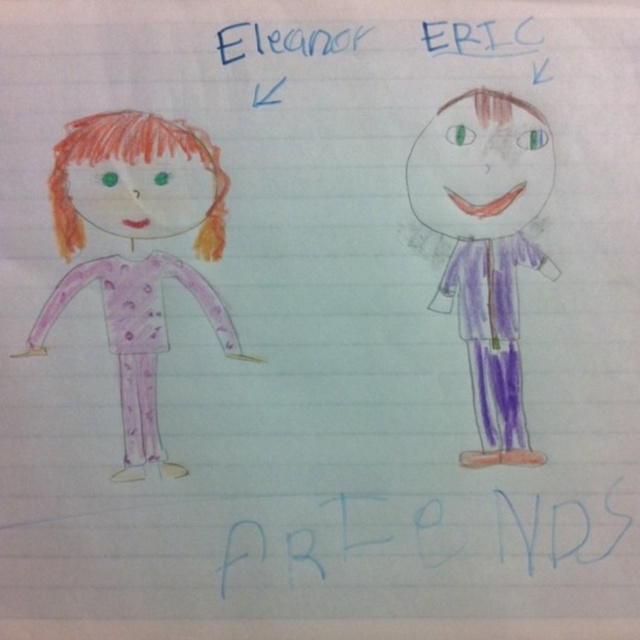
Does matte pink pajamas at left appear on the right side of blue paper at center?

Incorrect, matte pink pajamas at left is not on the right side of blue paper at center.

Who is more distant from viewer, (x=132, y=352) or (x=360, y=534)?

Positioned behind is point (x=132, y=352).

Who is more distant from viewer, (131, 461) or (220, 580)?

Positioned behind is point (131, 461).

Where is `matte pink pajamas at left`? Image resolution: width=640 pixels, height=640 pixels. matte pink pajamas at left is located at coordinates (138, 180).

Is blue paper at center smaller than purple paper doll at right?

Indeed, blue paper at center has a smaller size compared to purple paper doll at right.

Is blue paper at center further to camera compared to purple paper doll at right?

Yes, blue paper at center is further from the viewer.

Locate an element on the screen. Image resolution: width=640 pixels, height=640 pixels. blue paper at center is located at coordinates (428, 538).

Does matte pink pajamas at left have a lesser width compared to purple paper doll at right?

In fact, matte pink pajamas at left might be wider than purple paper doll at right.

Who is positioned more to the right, matte pink pajamas at left or purple paper doll at right?

purple paper doll at right

Where is `matte pink pajamas at left`? The image size is (640, 640). matte pink pajamas at left is located at coordinates (138, 180).